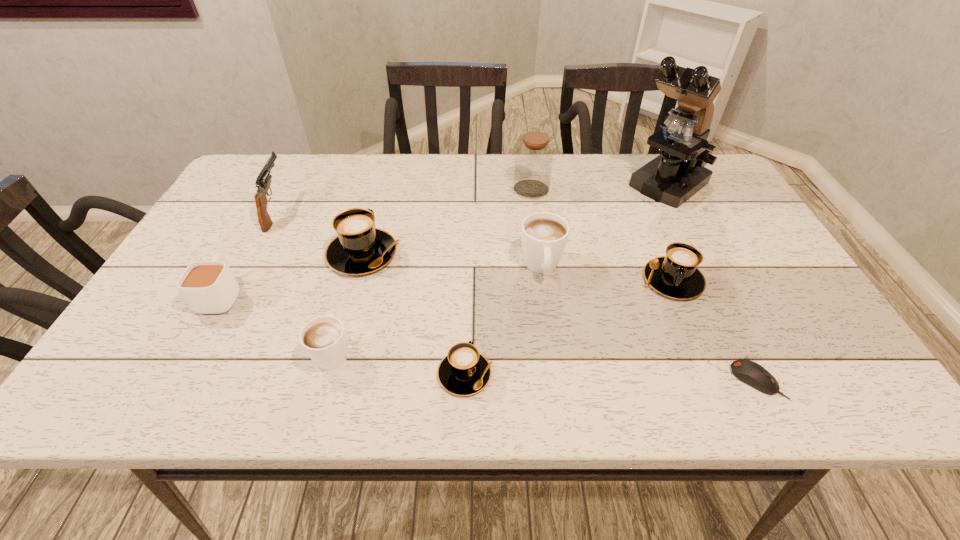
The width and height of the screenshot is (960, 540). Identify the location of free space between the microscope and the jar. (598, 188).

At what (x,y) coordinates should I click in order to perform the action: click on vacant space that is in between the second black cappuccino from left to right and the shortest object. Please return your answer as a coordinate pair (x, y). The width and height of the screenshot is (960, 540). Looking at the image, I should click on (611, 377).

Where is `free space between the black gun and the smaller white cappuccino`? The height and width of the screenshot is (540, 960). free space between the black gun and the smaller white cappuccino is located at coordinates (304, 281).

The image size is (960, 540). I want to click on free space between the nearer white cappuccino and the gun, so click(304, 281).

The image size is (960, 540). What are the coordinates of `vacant region between the biggest black cappuccino and the second cappuccino from right to left` in the screenshot? It's located at (452, 260).

What are the coordinates of `free point between the nearest black cappuccino and the rightmost cappuccino` in the screenshot? It's located at (568, 327).

Identify the location of vacant region between the rightmost black cappuccino and the farther white cappuccino. (607, 273).

Choose which object is the fourth nearest neighbor to the sixth object from right to left. Please provide its 2D coordinates. Your answer should be formatted as a tuple, i.e. [(x, y)], where the tuple contains the x and y coordinates of a point satisfying the conditions above.

[(676, 275)]

Locate an element on the screen. the closest object to the fourth cappuccino from left to right is located at coordinates click(x=676, y=275).

Find the location of a particular element. cappuccino that is the fourth nearest to the gun is located at coordinates (544, 235).